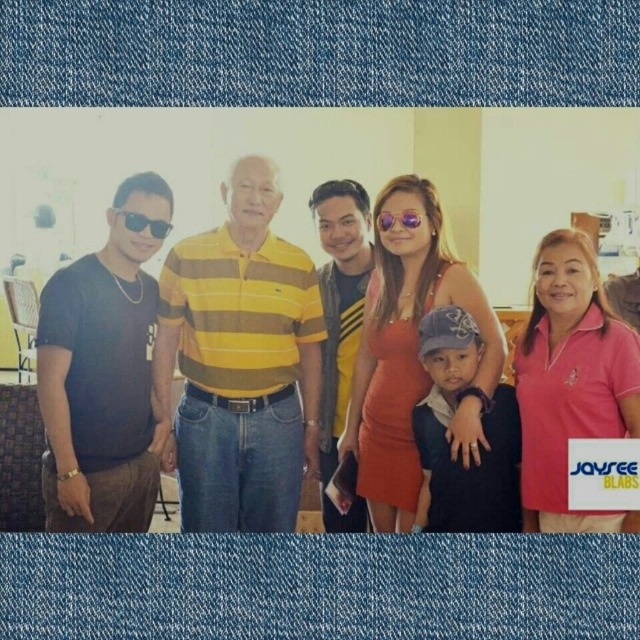
You are standing in the living room and see the matte yellow striped polo shirt at center and the dark blue denim jeans at center. If you want to grab the jeans first, which item should you move towards first?

The dark blue denim jeans at center are to the right of the matte yellow striped polo shirt at center. Since you want to grab the jeans first, you should move towards the dark blue denim jeans at center first as they are positioned to the right side.

You are a photographer trying to adjust the lighting for a group photo. You notice two pairs of sunglasses in the image. The matte black sunglasses at left and the sunglasses at center. Which pair might cast a larger shadow on the person wearing them due to their size?

The matte black sunglasses at left is bigger than sunglasses at center, so it would cast a larger shadow on the person wearing them.